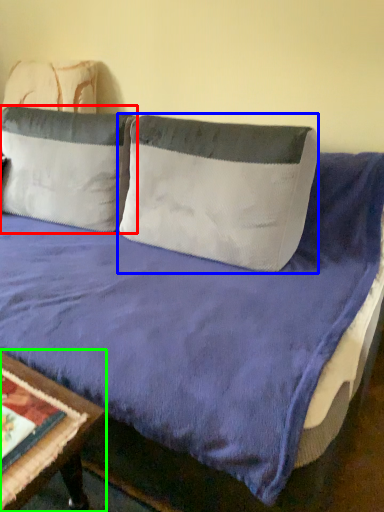
Question: Which object is the closest to the pillow (highlighted by a red box)? Choose among these: pillow (highlighted by a blue box) or table (highlighted by a green box).

Choices:
 (A) pillow
 (B) table

Answer: (A)